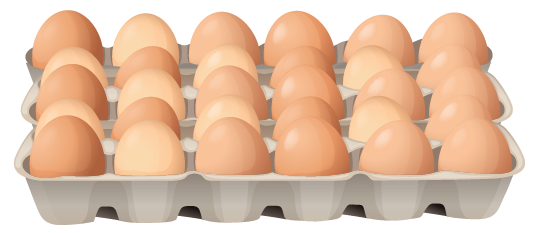
At what (x,y) coordinates should I click in order to perform the action: click on table. Please return your answer as a coordinate pair (x, y). Looking at the image, I should click on (271, 227).